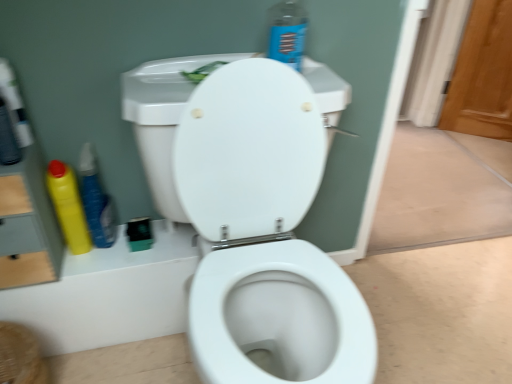
Locate an element on the screen. This screenshot has width=512, height=384. free location to the right of yellow plastic bottle at left, which ranks as the second cleaning product in left-to-right order is located at coordinates (154, 248).